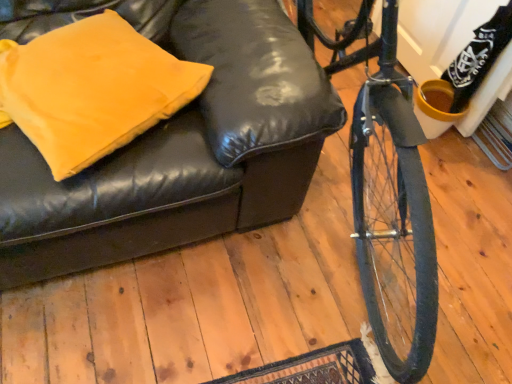
The image size is (512, 384). What do you see at coordinates (91, 89) in the screenshot?
I see `matte yellow pillow at upper left` at bounding box center [91, 89].

This screenshot has height=384, width=512. I want to click on matte yellow pillow at upper left, so click(x=91, y=89).

What are the coordinates of `matte yellow pillow at upper left` in the screenshot? It's located at (91, 89).